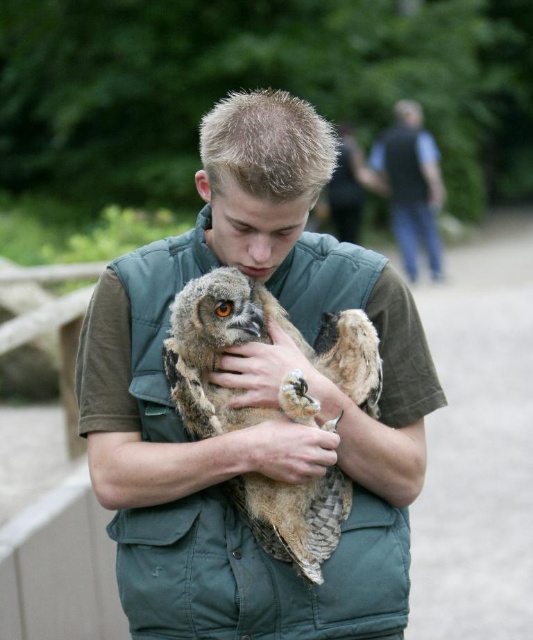
Is green fabric vest at center thinner than brown leather hand at center?

No, green fabric vest at center is not thinner than brown leather hand at center.

Between green fabric vest at center and brown leather hand at center, which one has less height?

With less height is brown leather hand at center.

Does point (231, 461) come in front of point (256, 349)?

Yes, point (231, 461) is closer to viewer.

What are the coordinates of `green fabric vest at center` in the screenshot? It's located at (252, 401).

Is brown textured owl at center bigger than dark gray vest at upper right?

No.

Between point (335, 444) and point (407, 198), which one is positioned behind?

Point (407, 198)

Locate an element on the screen. The width and height of the screenshot is (533, 640). brown textured owl at center is located at coordinates click(x=167, y=444).

Is green fabric vest at center behind brown textured owl at center?

No, green fabric vest at center is in front of brown textured owl at center.

Who is more distant from viewer, (x=360, y=602) or (x=99, y=472)?

Point (x=99, y=472)

Identify the location of green fabric vest at center. (252, 401).